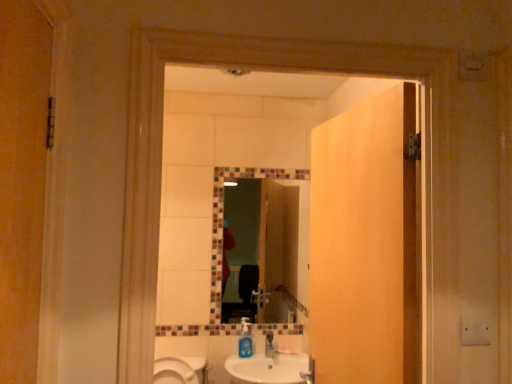
Question: Can you confirm if matte wood door at center is smaller than blue translucent soap dispenser at center?

Choices:
 (A) yes
 (B) no

Answer: (B)

Question: From the image's perspective, is matte wood door at center below blue translucent soap dispenser at center?

Choices:
 (A) yes
 (B) no

Answer: (B)

Question: Can you confirm if matte wood door at center is taller than blue translucent soap dispenser at center?

Choices:
 (A) no
 (B) yes

Answer: (B)

Question: Is there a large distance between matte wood door at center and blue translucent soap dispenser at center?

Choices:
 (A) no
 (B) yes

Answer: (B)

Question: Considering the relative positions of matte wood door at center and blue translucent soap dispenser at center in the image provided, is matte wood door at center to the left of blue translucent soap dispenser at center from the viewer's perspective?

Choices:
 (A) no
 (B) yes

Answer: (A)

Question: Considering the relative positions of matte wood door at center and blue translucent soap dispenser at center in the image provided, is matte wood door at center behind blue translucent soap dispenser at center?

Choices:
 (A) yes
 (B) no

Answer: (B)

Question: Does multicolored mosaic mirror at center have a lesser width compared to matte wood door at center?

Choices:
 (A) no
 (B) yes

Answer: (B)

Question: Is matte wood door at center a part of multicolored mosaic mirror at center?

Choices:
 (A) yes
 (B) no

Answer: (B)

Question: Does multicolored mosaic mirror at center appear on the left side of matte wood door at center?

Choices:
 (A) no
 (B) yes

Answer: (B)

Question: Is multicolored mosaic mirror at center at the right side of matte wood door at center?

Choices:
 (A) yes
 (B) no

Answer: (B)

Question: From a real-world perspective, is multicolored mosaic mirror at center under matte wood door at center?

Choices:
 (A) yes
 (B) no

Answer: (A)

Question: Is matte wood door at center at the back of multicolored mosaic mirror at center?

Choices:
 (A) no
 (B) yes

Answer: (A)

Question: Is matte wood door at center bigger than white glossy sink at lower center?

Choices:
 (A) no
 (B) yes

Answer: (B)